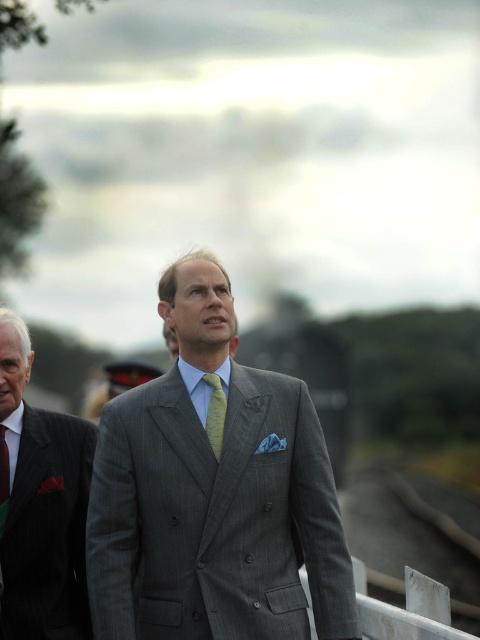
Question: Is dark gray pinstripe suit at center further to the viewer compared to white wood train track at lower right?

Choices:
 (A) no
 (B) yes

Answer: (A)

Question: Among these objects, which one is farthest from the camera?

Choices:
 (A) dark gray pinstripe suit at center
 (B) white wood train track at lower right
 (C) gray pinstripe suit at center

Answer: (B)

Question: Which of the following is the farthest from the observer?

Choices:
 (A) yellowstriped fabrictie at center
 (B) dark gray pinstripe suit at center

Answer: (B)

Question: Which object is positioned closest to the white wood train track at lower right?

Choices:
 (A) gray pinstripe suit at center
 (B) yellow silk tie at left
 (C) dark gray pinstripe suit at center
 (D) yellowstriped fabrictie at center

Answer: (A)

Question: Is gray pinstripe suit at center thinner than yellowstriped fabrictie at center?

Choices:
 (A) yes
 (B) no

Answer: (B)

Question: Is gray pinstripe suit at center positioned before yellow silk tie at left?

Choices:
 (A) yes
 (B) no

Answer: (A)